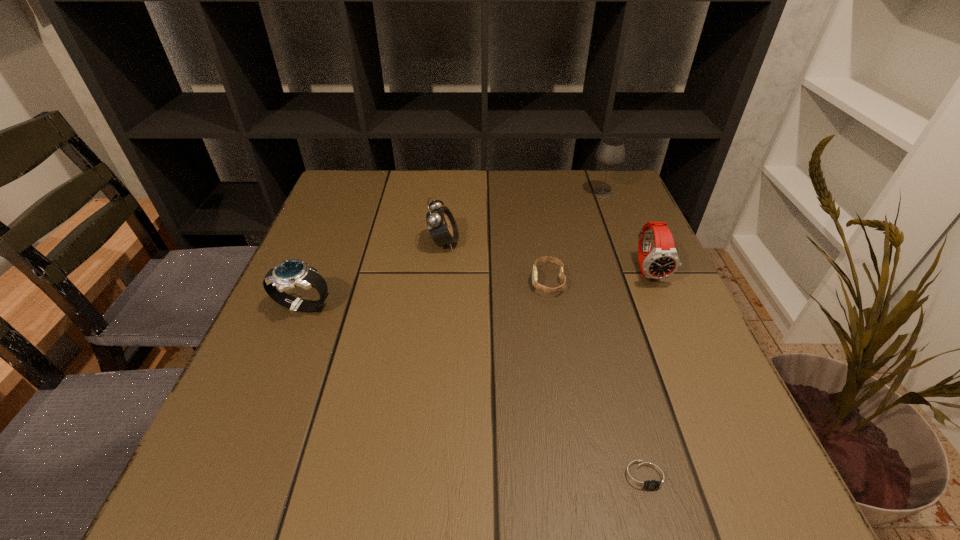
Locate an element on the screen. This screenshot has width=960, height=540. the tallest object is located at coordinates (611, 152).

Where is `the farthest object`? This screenshot has height=540, width=960. the farthest object is located at coordinates (611, 152).

The image size is (960, 540). Identify the location of alarm clock. (441, 224).

This screenshot has width=960, height=540. Find the location of `the rightmost watch`. the rightmost watch is located at coordinates (661, 262).

The image size is (960, 540). What are the coordinates of `the third shortest object` in the screenshot? It's located at (291, 273).

Image resolution: width=960 pixels, height=540 pixels. What are the coordinates of `the leftmost object` in the screenshot? It's located at (291, 273).

This screenshot has width=960, height=540. I want to click on the fourth object from right to left, so click(545, 289).

The height and width of the screenshot is (540, 960). In order to click on the third tallest watch in this screenshot , I will do `click(545, 289)`.

Identify the location of the nearest object. This screenshot has height=540, width=960. (645, 476).

What are the coordinates of `the third object from right to left` in the screenshot? It's located at (645, 476).